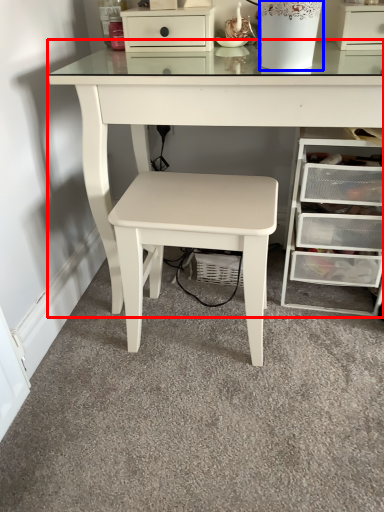
Question: Which object appears farthest to the camera in this image, table (highlighted by a red box) or glass vase (highlighted by a blue box)?

Choices:
 (A) table
 (B) glass vase

Answer: (B)